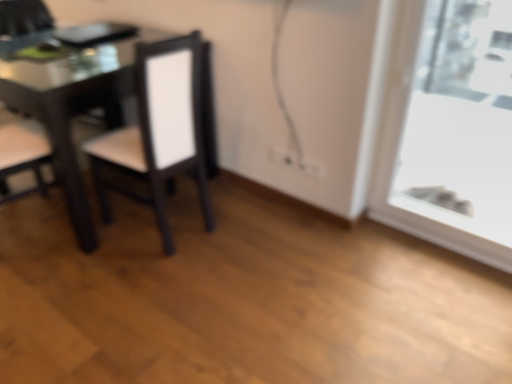
The image size is (512, 384). I want to click on matte black chair at center, the first chair from the right, so tap(160, 130).

Image resolution: width=512 pixels, height=384 pixels. In order to click on matte black chair at left, the first chair from the left in this screenshot , I will do `click(23, 25)`.

The image size is (512, 384). What do you see at coordinates (448, 128) in the screenshot? I see `transparent glass window at right` at bounding box center [448, 128].

Identify the location of matte black chair at center, the first chair from the right. (160, 130).

Is matte black chair at left, which is the 2th chair in right-to-left order, next to matte black chair at center, which ranks as the 2th chair in left-to-right order, and touching it?

No, matte black chair at left, which is the 2th chair in right-to-left order, is not in contact with matte black chair at center, which ranks as the 2th chair in left-to-right order.

Which object is closer to the camera taking this photo, matte black chair at left, which is the 2th chair in right-to-left order, or matte black chair at center, which ranks as the 2th chair in left-to-right order?

matte black chair at center, which ranks as the 2th chair in left-to-right order, is more forward.

From the image's perspective, which object appears higher, matte black chair at left, the first chair from the left, or matte black chair at center, the first chair from the right?

From the image's view, matte black chair at left, the first chair from the left, is above.

Between matte black chair at left, which is the 2th chair in right-to-left order, and matte black chair at center, the first chair from the right, which one has smaller width?

matte black chair at left, which is the 2th chair in right-to-left order.

Consider the image. Is transparent glass window at right in contact with matte black chair at center, the first chair from the right?

transparent glass window at right and matte black chair at center, the first chair from the right, are clearly separated.

From a real-world perspective, is transparent glass window at right positioned above or below matte black chair at center, which ranks as the 2th chair in left-to-right order?

Clearly, from a real-world perspective, transparent glass window at right is above matte black chair at center, which ranks as the 2th chair in left-to-right order.

Between transparent glass window at right and matte black chair at center, the first chair from the right, which one has larger size?

With larger size is matte black chair at center, the first chair from the right.

In the image, is transparent glass window at right positioned in front of or behind matte black chair at center, which ranks as the 2th chair in left-to-right order?

transparent glass window at right is positioned closer to the viewer than matte black chair at center, which ranks as the 2th chair in left-to-right order.

Which point is more distant from viewer, (27, 22) or (453, 169)?

The point (453, 169) is more distant.

Considering the relative sizes of matte black chair at left, the first chair from the left, and transparent glass window at right in the image provided, is matte black chair at left, the first chair from the left, taller than transparent glass window at right?

Incorrect, the height of matte black chair at left, the first chair from the left, is not larger of that of transparent glass window at right.

Is matte black chair at left, which is the 2th chair in right-to-left order, placed right next to transparent glass window at right?

matte black chair at left, which is the 2th chair in right-to-left order, and transparent glass window at right are clearly separated.

In the scene shown: Choose the correct answer: Is transparent glass window at right inside matte black chair at left, the first chair from the left, or outside it?

transparent glass window at right is spatially situated outside matte black chair at left, the first chair from the left.

From the picture: Is transparent glass window at right facing away from matte black chair at left, which is the 2th chair in right-to-left order?

That's not correct — transparent glass window at right is not looking away from matte black chair at left, which is the 2th chair in right-to-left order.

From the image's perspective, which is below, transparent glass window at right or matte black chair at left, the first chair from the left?

transparent glass window at right appears lower in the image.

In the scene shown: Could you measure the distance between transparent glass window at right and matte black chair at left, the first chair from the left?

transparent glass window at right and matte black chair at left, the first chair from the left, are 2.14 meters apart.

From the image's perspective, is matte black chair at center, the first chair from the right, below matte black chair at left, the first chair from the left?

Yes.

Does matte black chair at center, the first chair from the right, touch matte black chair at left, the first chair from the left?

They are not placed beside each other.

Is matte black chair at center, which ranks as the 2th chair in left-to-right order, looking in the opposite direction of matte black chair at left, the first chair from the left?

No.

Is matte black chair at center, which ranks as the 2th chair in left-to-right order, aimed at transparent glass window at right?

No, matte black chair at center, which ranks as the 2th chair in left-to-right order, is not turned towards transparent glass window at right.

Is matte black chair at center, the first chair from the right, inside the boundaries of transparent glass window at right, or outside?

matte black chair at center, the first chair from the right, cannot be found inside transparent glass window at right.

From the image's perspective, is matte black chair at center, which ranks as the 2th chair in left-to-right order, on transparent glass window at right?

Yes, from the image's perspective, matte black chair at center, which ranks as the 2th chair in left-to-right order, is over transparent glass window at right.

Can you confirm if matte black chair at center, the first chair from the right, is smaller than transparent glass window at right?

No, matte black chair at center, the first chair from the right, is not smaller than transparent glass window at right.

Where is `chair behind the matte black chair at center, which ranks as the 2th chair in left-to-right order`? This screenshot has width=512, height=384. chair behind the matte black chair at center, which ranks as the 2th chair in left-to-right order is located at coordinates coord(23,25).

Identify the location of window above the matte black chair at center, the first chair from the right (from a real-world perspective). (448, 128).

When comparing their distances from transparent glass window at right, does matte black chair at left, which is the 2th chair in right-to-left order, or matte black chair at center, the first chair from the right, seem closer?

Among the two, matte black chair at center, the first chair from the right, is located nearer to transparent glass window at right.

Considering their positions, is matte black chair at center, the first chair from the right, positioned further to transparent glass window at right than matte black chair at left, which is the 2th chair in right-to-left order?

matte black chair at left, which is the 2th chair in right-to-left order, lies further to transparent glass window at right than the other object.

Based on the photo, from the image, which object appears to be nearer to matte black chair at center, which ranks as the 2th chair in left-to-right order, transparent glass window at right or matte black chair at left, which is the 2th chair in right-to-left order?

matte black chair at left, which is the 2th chair in right-to-left order, lies closer to matte black chair at center, which ranks as the 2th chair in left-to-right order, than the other object.

Based on their spatial positions, is matte black chair at left, the first chair from the left, or transparent glass window at right closer to matte black chair at center, which ranks as the 2th chair in left-to-right order?

matte black chair at left, the first chair from the left, lies closer to matte black chair at center, which ranks as the 2th chair in left-to-right order, than the other object.

Which object lies nearer to the anchor point matte black chair at left, the first chair from the left, transparent glass window at right or matte black chair at center, which ranks as the 2th chair in left-to-right order?

matte black chair at center, which ranks as the 2th chair in left-to-right order, lies closer to matte black chair at left, the first chair from the left, than the other object.

Looking at this image, from the image, which object appears to be farther from matte black chair at left, which is the 2th chair in right-to-left order, matte black chair at center, which ranks as the 2th chair in left-to-right order, or transparent glass window at right?

Based on the image, transparent glass window at right appears to be further to matte black chair at left, which is the 2th chair in right-to-left order.

This screenshot has width=512, height=384. In order to click on chair located between matte black chair at left, which is the 2th chair in right-to-left order, and transparent glass window at right in the left-right direction in this screenshot , I will do `click(160, 130)`.